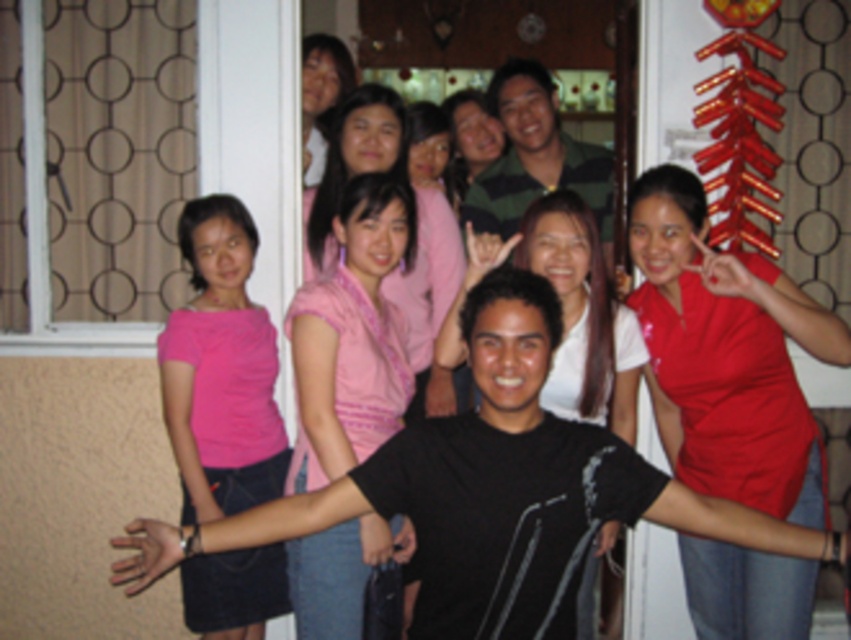
Who is positioned more to the left, black matte shirt at center or striped cotton shirt at center?

black matte shirt at center

Which is more to the right, black matte shirt at center or striped cotton shirt at center?

striped cotton shirt at center

Does point (523, 394) lie in front of point (509, 154)?

Yes, it is.

You are a GUI agent. You are given a task and a screenshot of the screen. Output one action in this format:
    pyautogui.click(x=<x>, y=<y>)
    Task: Click on the black matte shirt at center
    This screenshot has height=640, width=851.
    Given the screenshot: What is the action you would take?
    click(256, 522)

Can you confirm if red matte shirt at right is positioned to the left of pink matte shirt at left?

No, red matte shirt at right is not to the left of pink matte shirt at left.

Does point (798, 396) come in front of point (160, 372)?

Yes, it is in front of point (160, 372).

Find the location of a particular element. red matte shirt at right is located at coordinates (726, 355).

Locate an element on the screen. red matte shirt at right is located at coordinates (726, 355).

Who is more forward, [374,397] or [317,35]?

Point [374,397] is more forward.

Can you confirm if pink satin blouse at center is smaller than pink fabric shirt at upper center?

No, pink satin blouse at center is not smaller than pink fabric shirt at upper center.

You are a GUI agent. You are given a task and a screenshot of the screen. Output one action in this format:
    pyautogui.click(x=<x>, y=<y>)
    Task: Click on the pink satin blouse at center
    Image resolution: width=851 pixels, height=640 pixels.
    Given the screenshot: What is the action you would take?
    pyautogui.click(x=352, y=337)

The width and height of the screenshot is (851, 640). I want to click on pink satin blouse at center, so click(x=352, y=337).